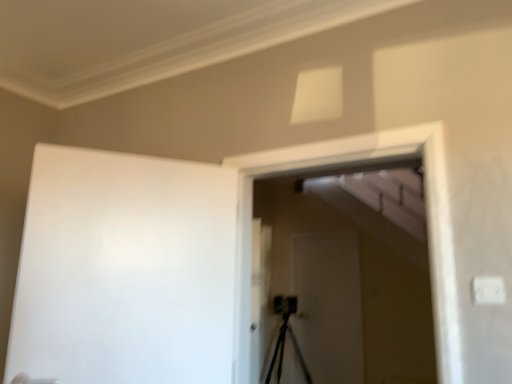
The height and width of the screenshot is (384, 512). What do you see at coordinates (343, 277) in the screenshot? I see `white matte screen door at center, the 2th screen door from the back` at bounding box center [343, 277].

Where is `white matte barn door at left`? This screenshot has height=384, width=512. white matte barn door at left is located at coordinates (125, 270).

Is white matte screen door at center, marked as the 1th screen door in a front-to-back arrangement, next to white matte screen door at center, which appears as the first screen door when viewed from the back, and touching it?

No, white matte screen door at center, marked as the 1th screen door in a front-to-back arrangement, is not with white matte screen door at center, which appears as the first screen door when viewed from the back.

Does point (344, 250) come behind point (337, 338)?

Yes, point (344, 250) is farther from viewer.

Looking at this image, is white matte screen door at center, marked as the 1th screen door in a front-to-back arrangement, spatially inside white matte screen door at center, which appears as the first screen door when viewed from the back, or outside of it?

white matte screen door at center, marked as the 1th screen door in a front-to-back arrangement, is spatially situated outside white matte screen door at center, which appears as the first screen door when viewed from the back.

Does white matte screen door at center, the 2th screen door from the back, have a greater width compared to white matte screen door at center, the second screen door viewed from the front?

Yes, white matte screen door at center, the 2th screen door from the back, is wider than white matte screen door at center, the second screen door viewed from the front.

Is point (151, 298) more distant than point (254, 213)?

No, it is not.

Would you say white matte barn door at left is inside or outside white matte screen door at center, the 2th screen door from the back?

white matte barn door at left is not inside white matte screen door at center, the 2th screen door from the back, it's outside.

From a real-world perspective, relative to white matte screen door at center, the 2th screen door from the back, is white matte barn door at left vertically above or below?

In terms of real-world spatial position, white matte barn door at left is below white matte screen door at center, the 2th screen door from the back.

Consider the image. Can you confirm if white matte barn door at left is wider than white matte screen door at center, marked as the 1th screen door in a front-to-back arrangement?

No.

Can you confirm if white matte screen door at center, the second screen door viewed from the front, is bigger than white matte barn door at left?

Actually, white matte screen door at center, the second screen door viewed from the front, might be smaller than white matte barn door at left.

From a real-world perspective, who is located lower, white matte screen door at center, the second screen door viewed from the front, or white matte barn door at left?

From a 3D spatial view, white matte screen door at center, the second screen door viewed from the front, is below.

From the image's perspective, does white matte screen door at center, the second screen door viewed from the front, appear higher than white matte barn door at left?

No, from the image's perspective, white matte screen door at center, the second screen door viewed from the front, is not above white matte barn door at left.

Is white matte screen door at center, the second screen door viewed from the front, turned away from white matte barn door at left?

No, white matte barn door at left is not at the back of white matte screen door at center, the second screen door viewed from the front.

In the image, is white matte screen door at center, the 2th screen door from the back, on the left side or the right side of white matte barn door at left?

Based on their positions, white matte screen door at center, the 2th screen door from the back, is located to the right of white matte barn door at left.

Is white matte screen door at center, marked as the 1th screen door in a front-to-back arrangement, not inside white matte barn door at left?

Yes.

In the image, is white matte screen door at center, the 2th screen door from the back, positioned in front of or behind white matte barn door at left?

white matte screen door at center, the 2th screen door from the back, is positioned farther from the viewer than white matte barn door at left.

Is white matte screen door at center, the 2th screen door from the back, positioned with its back to white matte barn door at left?

white matte screen door at center, the 2th screen door from the back, does not have its back to white matte barn door at left.

Where is `barn door above the white matte screen door at center, which appears as the first screen door when viewed from the back (from the image's perspective)`? The height and width of the screenshot is (384, 512). barn door above the white matte screen door at center, which appears as the first screen door when viewed from the back (from the image's perspective) is located at coordinates (125, 270).

Between white matte barn door at left and white matte screen door at center, the second screen door viewed from the front, which one has smaller width?

Thinner between the two is white matte screen door at center, the second screen door viewed from the front.

Considering their positions, is white matte barn door at left located in front of or behind white matte screen door at center, which appears as the first screen door when viewed from the back?

white matte barn door at left is positioned closer to the viewer than white matte screen door at center, which appears as the first screen door when viewed from the back.

Could you tell me if white matte barn door at left is turned towards white matte screen door at center, which appears as the first screen door when viewed from the back?

No, white matte barn door at left is not facing towards white matte screen door at center, which appears as the first screen door when viewed from the back.

Would you say white matte screen door at center, the second screen door viewed from the front, is inside or outside white matte screen door at center, marked as the 1th screen door in a front-to-back arrangement?

white matte screen door at center, the second screen door viewed from the front, exists outside the volume of white matte screen door at center, marked as the 1th screen door in a front-to-back arrangement.

Is white matte screen door at center, marked as the 1th screen door in a front-to-back arrangement, at the back of white matte screen door at center, the second screen door viewed from the front?

No, white matte screen door at center, the second screen door viewed from the front, is not facing the opposite direction of white matte screen door at center, marked as the 1th screen door in a front-to-back arrangement.

Does white matte screen door at center, the second screen door viewed from the front, have a smaller size compared to white matte screen door at center, marked as the 1th screen door in a front-to-back arrangement?

Indeed, white matte screen door at center, the second screen door viewed from the front, has a smaller size compared to white matte screen door at center, marked as the 1th screen door in a front-to-back arrangement.

Can you confirm if white matte screen door at center, the second screen door viewed from the front, is taller than white matte screen door at center, the 2th screen door from the back?

Indeed, white matte screen door at center, the second screen door viewed from the front, has a greater height compared to white matte screen door at center, the 2th screen door from the back.

Locate an element on the screen. The height and width of the screenshot is (384, 512). screen door that appears below the white matte screen door at center, marked as the 1th screen door in a front-to-back arrangement (from a real-world perspective) is located at coordinates coord(329,305).

Where is `the 1st screen door counting from the right side of the white matte barn door at left`? The image size is (512, 384). the 1st screen door counting from the right side of the white matte barn door at left is located at coordinates (343, 277).

Based on their spatial positions, is white matte barn door at left or white matte screen door at center, marked as the 1th screen door in a front-to-back arrangement, closer to white matte screen door at center, the second screen door viewed from the front?

Among the two, white matte screen door at center, marked as the 1th screen door in a front-to-back arrangement, is located nearer to white matte screen door at center, the second screen door viewed from the front.

Which object lies nearer to the anchor point white matte screen door at center, the 2th screen door from the back, white matte screen door at center, which appears as the first screen door when viewed from the back, or white matte barn door at left?

Based on the image, white matte screen door at center, which appears as the first screen door when viewed from the back, appears to be nearer to white matte screen door at center, the 2th screen door from the back.

Consider the image. From the image, which object appears to be farther from white matte screen door at center, marked as the 1th screen door in a front-to-back arrangement, white matte barn door at left or white matte screen door at center, which appears as the first screen door when viewed from the back?

white matte barn door at left is positioned further to the anchor white matte screen door at center, marked as the 1th screen door in a front-to-back arrangement.

Considering their positions, is white matte screen door at center, marked as the 1th screen door in a front-to-back arrangement, positioned closer to white matte barn door at left than white matte screen door at center, the second screen door viewed from the front?

Among the two, white matte screen door at center, marked as the 1th screen door in a front-to-back arrangement, is located nearer to white matte barn door at left.

Estimate the real-world distances between objects in this image. Which object is further from white matte screen door at center, the second screen door viewed from the front, white matte screen door at center, the 2th screen door from the back, or white matte barn door at left?

The object further to white matte screen door at center, the second screen door viewed from the front, is white matte barn door at left.

Considering their positions, is white matte screen door at center, which appears as the first screen door when viewed from the back, positioned closer to white matte barn door at left than white matte screen door at center, the 2th screen door from the back?

Among the two, white matte screen door at center, the 2th screen door from the back, is located nearer to white matte barn door at left.

At what (x,y) coordinates should I click in order to perform the action: click on screen door between white matte barn door at left and white matte screen door at center, the second screen door viewed from the front, along the z-axis. Please return your answer as a coordinate pair (x, y). Looking at the image, I should click on [343, 277].